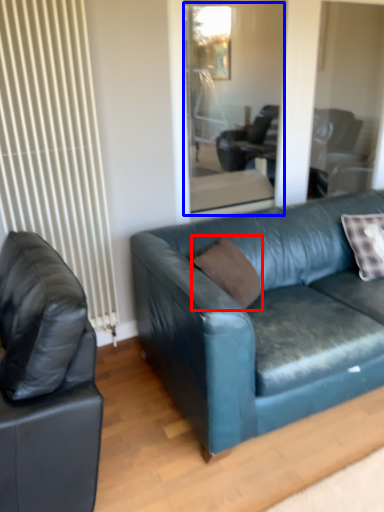
Question: Which of the following is the closest to the observer, pillow (highlighted by a red box) or glass door (highlighted by a blue box)?

Choices:
 (A) pillow
 (B) glass door

Answer: (A)